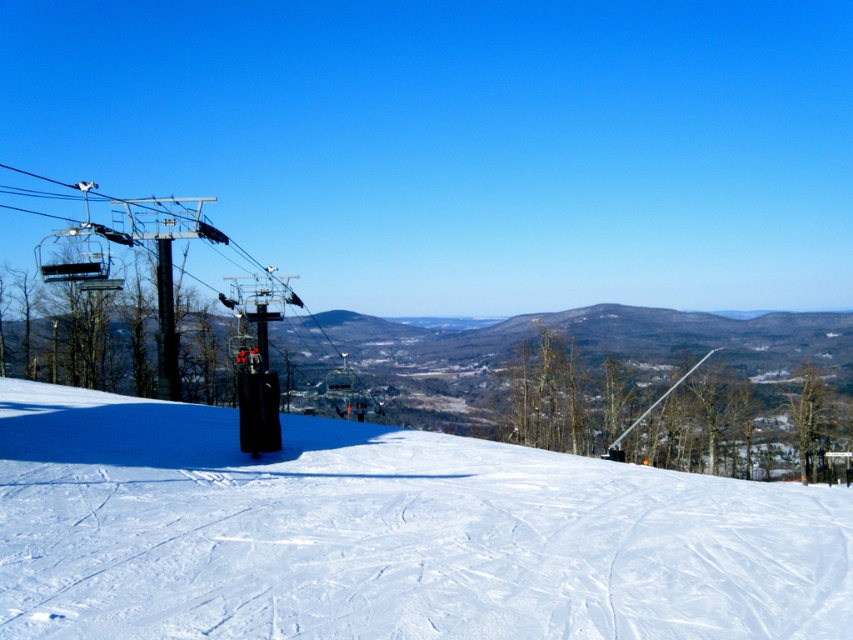
Looking at this image, measure the distance from white powdery snow at center to metallic gray ski lift at left.

white powdery snow at center is 43.35 feet from metallic gray ski lift at left.

Is white powdery snow at center thinner than metallic gray ski lift at left?

Yes, white powdery snow at center is thinner than metallic gray ski lift at left.

Find the location of a particular element. white powdery snow at center is located at coordinates (386, 532).